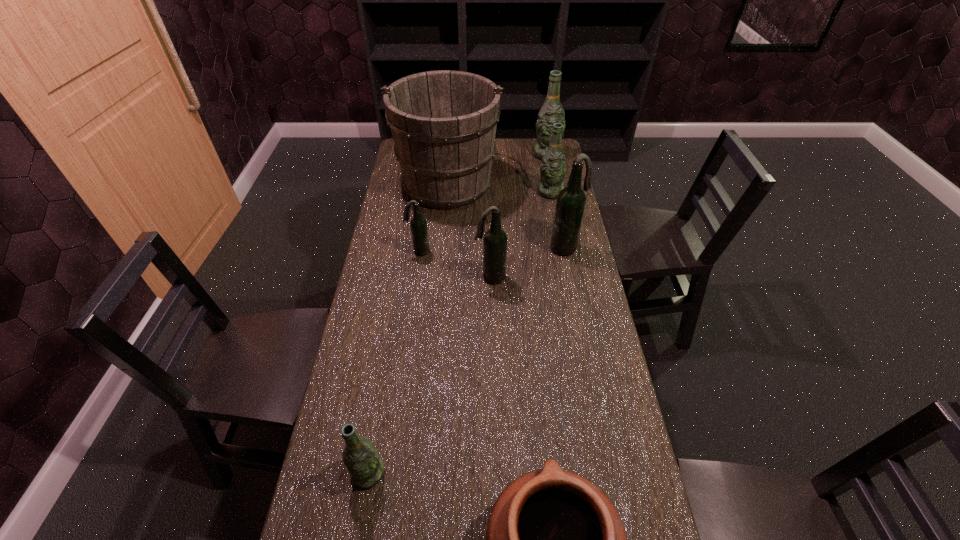
Where is `bucket`? The width and height of the screenshot is (960, 540). bucket is located at coordinates (443, 123).

This screenshot has height=540, width=960. What are the coordinates of `the farthest green beer bottle` in the screenshot? It's located at [x=552, y=111].

Image resolution: width=960 pixels, height=540 pixels. I want to click on the biggest green beer bottle, so click(x=552, y=111).

Where is `the rightmost dark beer bottle`? The height and width of the screenshot is (540, 960). the rightmost dark beer bottle is located at coordinates (571, 200).

Image resolution: width=960 pixels, height=540 pixels. I want to click on the second smallest green beer bottle, so pos(553,167).

The height and width of the screenshot is (540, 960). I want to click on the fifth nearest beer bottle, so click(x=553, y=167).

Identify the location of the sixth farthest object. (495, 239).

You are a GUI agent. You are given a task and a screenshot of the screen. Output one action in this format:
    pyautogui.click(x=<x>, y=<y>)
    Task: Click on the nearest dark beer bottle
    Image resolution: width=960 pixels, height=540 pixels.
    Given the screenshot: What is the action you would take?
    pyautogui.click(x=495, y=239)

Find the location of a particular element. the smallest dark beer bottle is located at coordinates (418, 224).

This screenshot has width=960, height=540. I want to click on the leftmost green beer bottle, so click(366, 468).